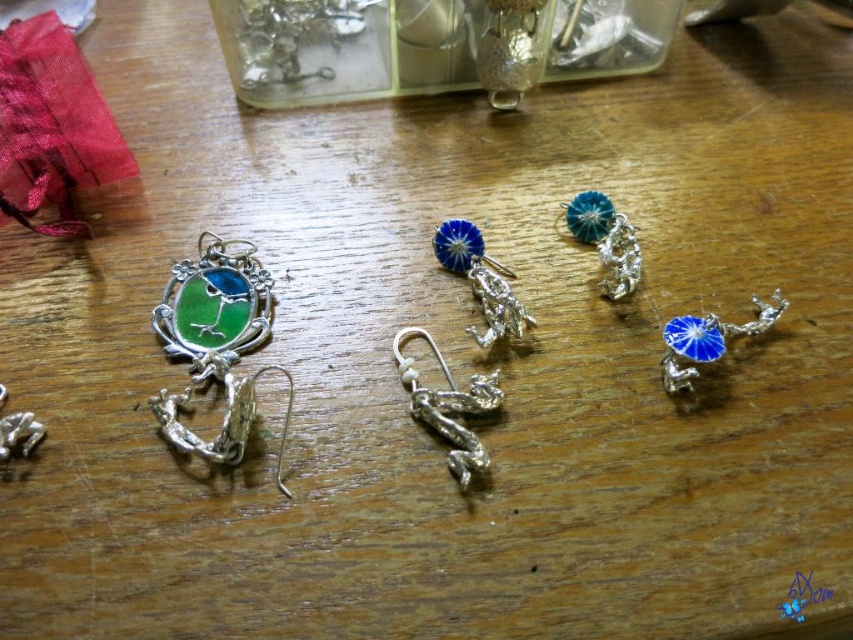
You are organizing the jewelry display and need to place the silver metallic hook at center and the blue enamel charm at right. Based on their positions in the image, which one is closer to you?

The silver metallic hook at center is closer to you because it is in front of the blue enamel charm at right.

In the scene shown: You are a jeweler who needs to place a 30 cm long chain between the silver metallic hook at center and the blue enamel charm at right. Can the chain fit between them?

The silver metallic hook at center and blue enamel charm at right are 31.21 centimeters apart from each other, so yes, the 30 cm long chain can fit between them since it is shorter than the distance between the two objects.

You are a jeweler organizing pieces on a display. You need to place the silver metallic hook at center and the blue enamel charm at right on a shelf. Which object should be placed first if you want to arrange them from tallest to shortest?

The silver metallic hook at center is much taller than the blue enamel charm at right, so you should place the silver metallic hook at center first when arranging from tallest to shortest.